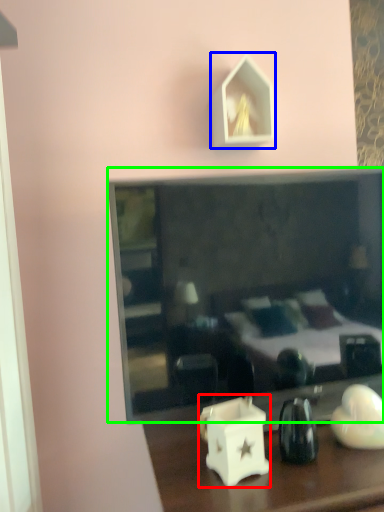
Question: Which object is the farthest from candle holder (highlighted by a red box)? Choose among these: picture frame (highlighted by a blue box) or mirror (highlighted by a green box).

Choices:
 (A) picture frame
 (B) mirror

Answer: (A)